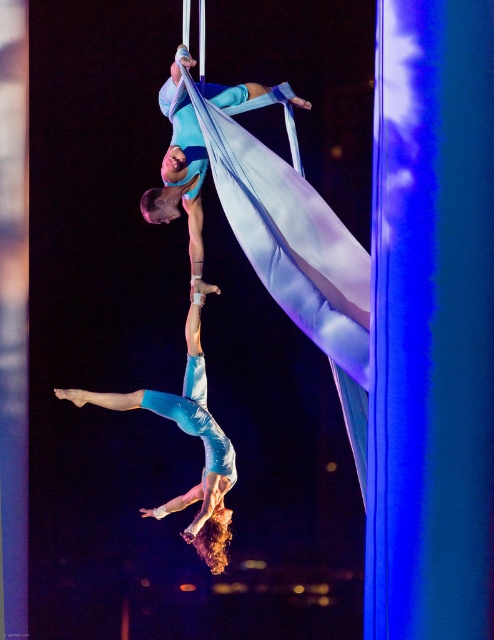
You are a photographer capturing this aerial performance. You want to ensure the light blue fabric at center is in focus. What specific coordinate should you aim your camera at?

The light blue fabric at center is located at coordinate point (189, 433), so you should aim your camera at that point to ensure it is in focus.

You are a photographer capturing this aerial performance. You want to ensure the light blue fabric at center and the matte blue fabric at upper center are both visible in your shot. Which fabric should you focus on first to frame the composition properly?

The matte blue fabric at upper center should be focused on first since the light blue fabric at center is positioned under it, meaning the upper fabric might block part of the lower one if not framed correctly.